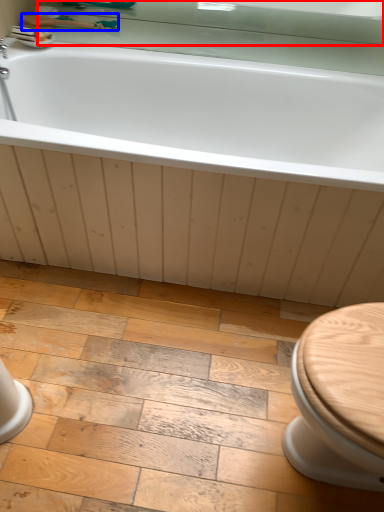
Question: Which object is closer to the camera taking this photo, mirror (highlighted by a red box) or shower (highlighted by a blue box)?

Choices:
 (A) mirror
 (B) shower

Answer: (A)